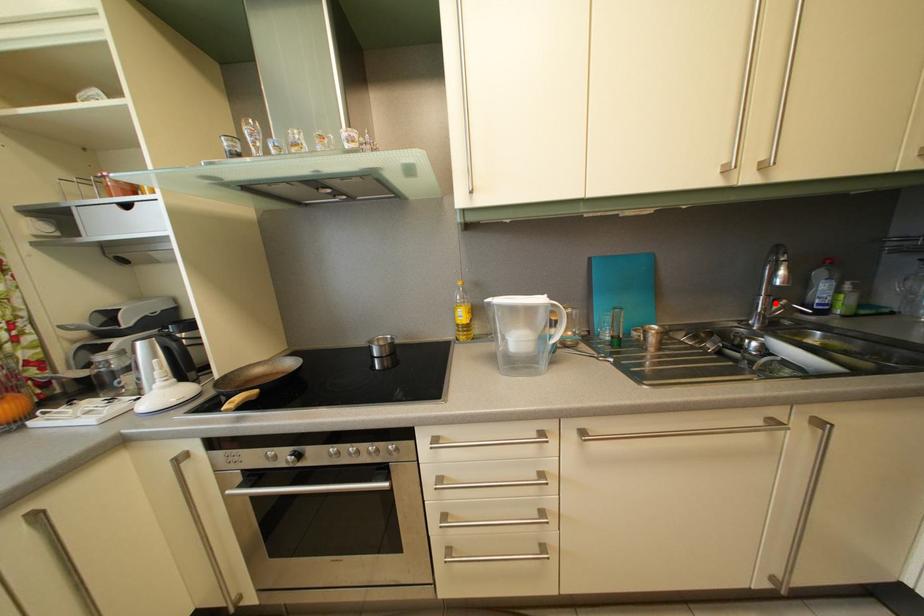
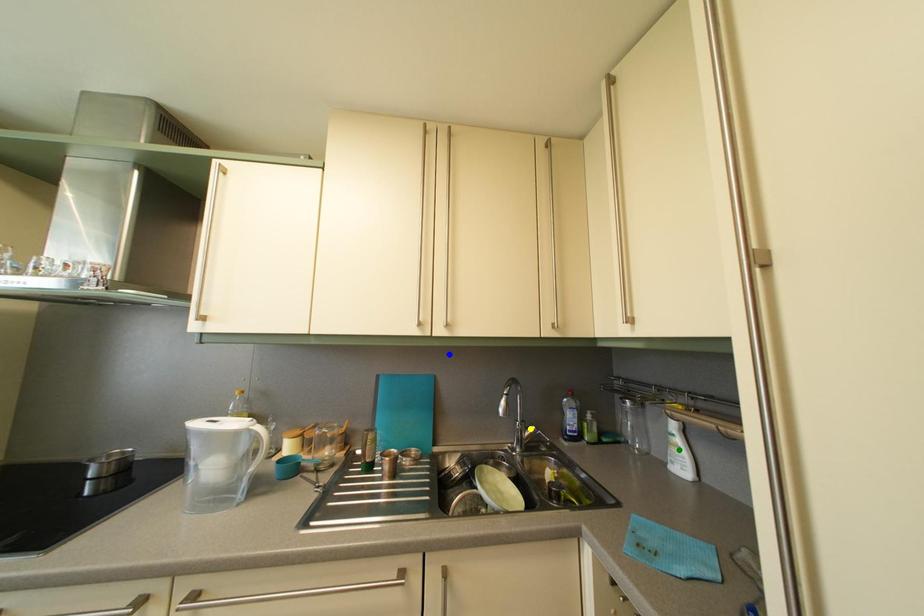
Question: I am providing you with two images of the same scene from different viewpoints. A red point is marked on the first image. You are given multiple points on the second image. Which point in image 2 is actually the same real-world point as the red point in image 1?

Choices:
 (A) yellow point
 (B) blue point
 (C) green point

Answer: (A)